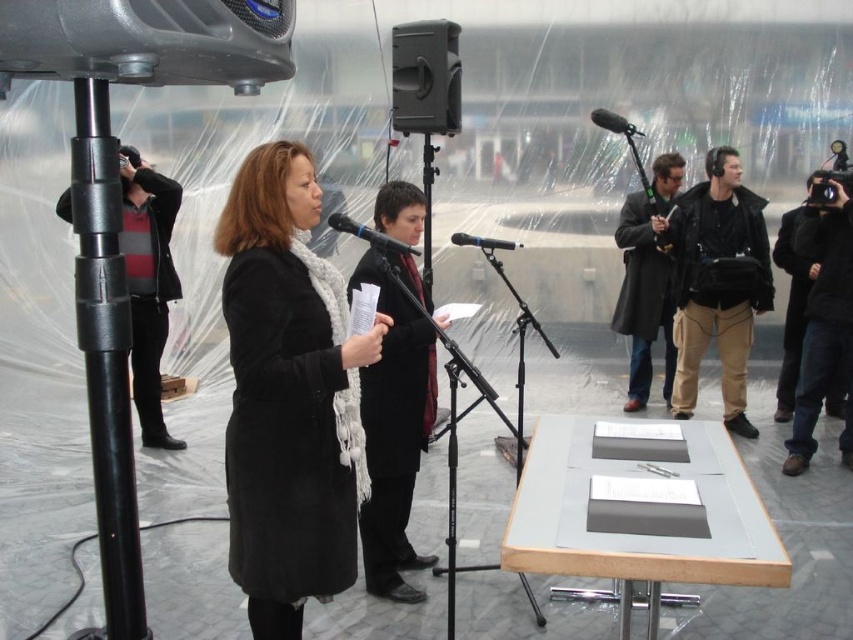
You are standing at the center of the room and see a point at coordinates (x=717, y=282). Which object is this point located on?

The point is located on the black leather jacket at right.

Based on the photo, you are an event organizer and need to arrange the seating for the speakers. The black leather jacket at right and the dark gray coat at right are both presenters. Which presenter should sit to the left of the other based on their current positions?

The dark gray coat at right should sit to the left of the black leather jacket at right because the black leather jacket at right is positioned on the right side of the dark gray coat at right.

You are organizing a presentation and need to place a decorative item on the table. The black wool coat at center and the black matte microphone at upper center are both on the table. Which object takes up more space on the table?

The black wool coat at center is larger in size than the black matte microphone at upper center, so it takes up more space on the table.